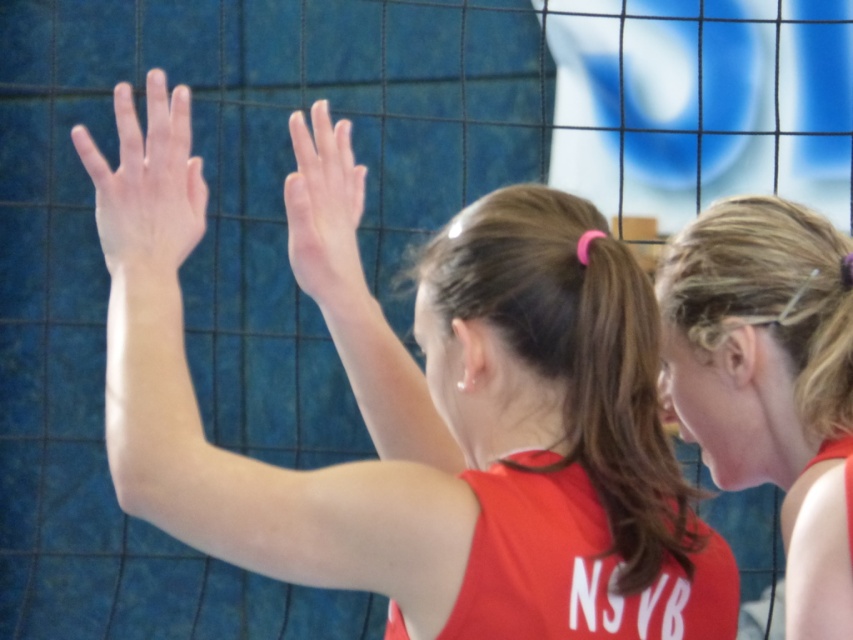
You are a photographer standing behind the two players. You want to take a photo that includes both the matte red jersey at center and the matte red tank top at upper right. The minimum distance between them in the photo should be 12 inches. Can you capture them in one shot with this requirement?

The distance between the matte red jersey at center and the matte red tank top at upper right is 11.67 inches, which is less than the required 12 inches. Therefore, you can capture them in one shot as the distance is sufficient.

You are a photographer standing behind the players. You want to take a photo that clearly shows both the matte red jersey at center and the smooth skin hand at center. Will the hand be in front of or behind the jersey in the photo?

The matte red jersey at center is closer to the viewer than the smooth skin hand at center, so in the photo, the hand will be behind the jersey.